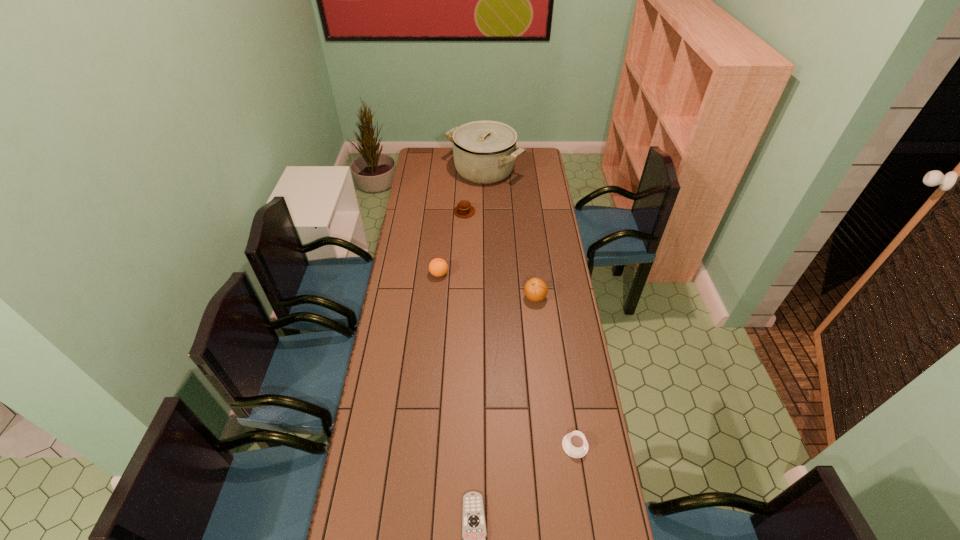
Identify the location of orange that is at the right edge. This screenshot has width=960, height=540. (535, 289).

Locate an element on the screen. The height and width of the screenshot is (540, 960). teacup that is at the right edge is located at coordinates (574, 444).

The image size is (960, 540). In order to click on object that is at the far right corner in this screenshot , I will do `click(484, 152)`.

I want to click on free spot at the left edge of the desktop, so click(389, 333).

In the image, there is a desktop. Find the location of `vacant space at the right edge`. vacant space at the right edge is located at coordinates (601, 474).

In the image, there is a desktop. Where is `free region at the far left corner`? free region at the far left corner is located at coordinates click(x=435, y=154).

Locate an element on the screen. free point at the far right corner is located at coordinates (547, 167).

Find the location of a particular element. The width and height of the screenshot is (960, 540). empty space that is in between the third farthest object and the fourth farthest object is located at coordinates (487, 286).

The image size is (960, 540). Find the location of `empty space between the third nearest object and the farthest object`. empty space between the third nearest object and the farthest object is located at coordinates (510, 234).

I want to click on free space between the nearer orange and the tallest object, so click(x=510, y=234).